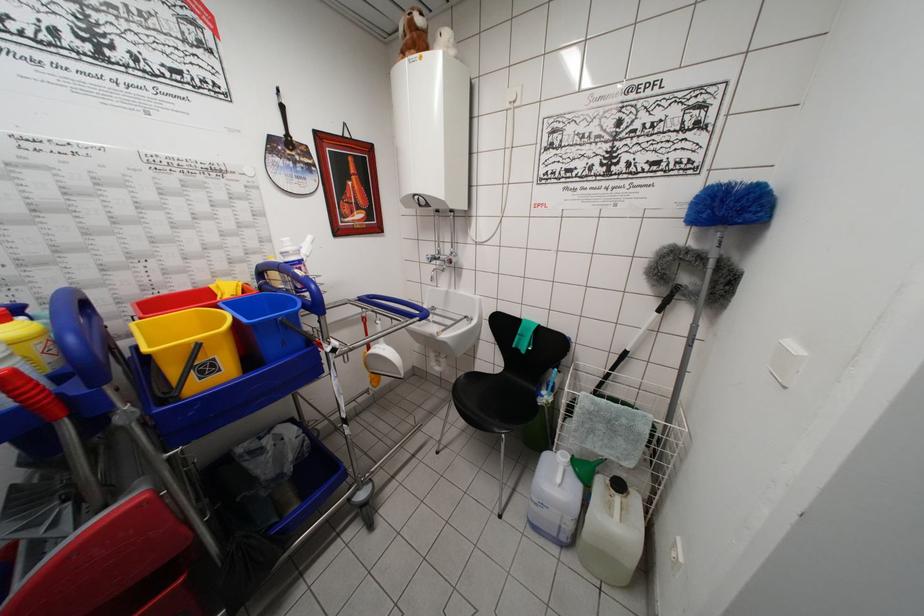
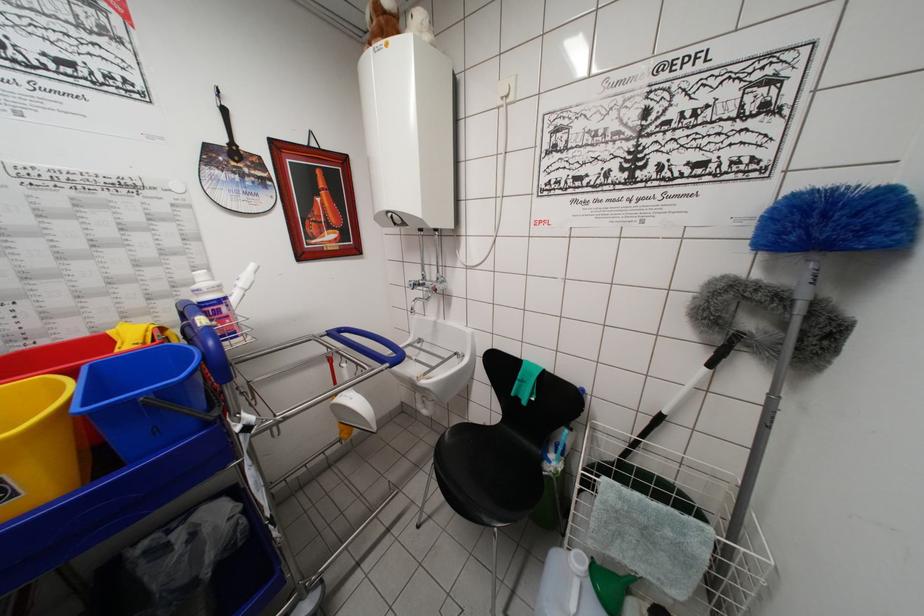
Locate, in the second image, the point that corresponds to pixel 624 358 in the first image.

(658, 419)